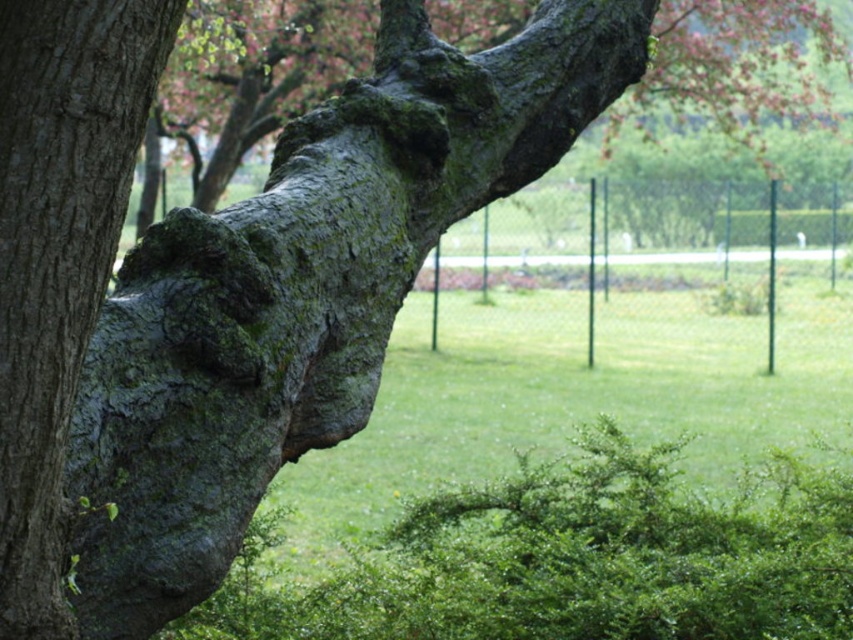
Is green mossy bark at center bigger than smooth bark tree trunk at center?

Incorrect, green mossy bark at center is not larger than smooth bark tree trunk at center.

At what (x,y) coordinates should I click in order to perform the action: click on green mossy bark at center. Please return your answer as a coordinate pair (x, y). The height and width of the screenshot is (640, 853). Looking at the image, I should click on [x=59, y=253].